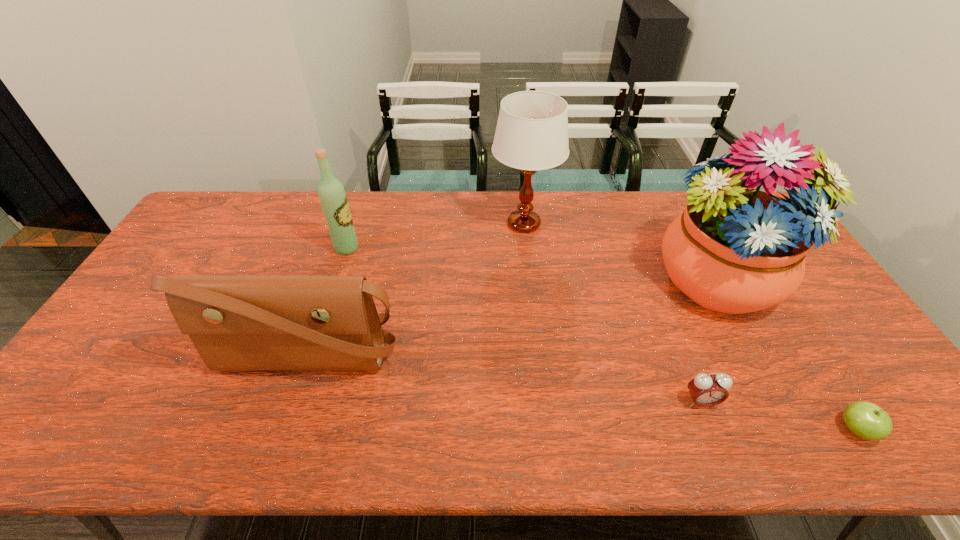
At what (x,y) coordinates should I click in order to perform the action: click on empty space that is in between the wine bottle and the shortest object. Please return your answer as a coordinate pair (x, y). Looking at the image, I should click on (601, 339).

Locate which object is the fourth closest to the satchel. Please provide its 2D coordinates. Your answer should be formatted as a tuple, i.e. [(x, y)], where the tuple contains the x and y coordinates of a point satisfying the conditions above.

[(734, 249)]

This screenshot has height=540, width=960. I want to click on object that is the fifth closest to the wine bottle, so click(866, 420).

Locate an element on the screen. The width and height of the screenshot is (960, 540). vacant space that satisfies the following two spatial constraints: 1. on the front-facing side of the wine bottle; 2. on the left side of the shortest object is located at coordinates (289, 430).

Locate an element on the screen. free region that satisfies the following two spatial constraints: 1. on the front flap of the satchel; 2. on the right side of the shortest object is located at coordinates (281, 430).

Where is `free space that satisfies the following two spatial constraints: 1. on the front-facing side of the flower arrangement; 2. on the left side of the wine bottle`? The height and width of the screenshot is (540, 960). free space that satisfies the following two spatial constraints: 1. on the front-facing side of the flower arrangement; 2. on the left side of the wine bottle is located at coordinates (336, 284).

Identify the location of free region that satisfies the following two spatial constraints: 1. on the front-facing side of the wine bottle; 2. on the front flap of the satchel. This screenshot has width=960, height=540. (313, 355).

Locate an element on the screen. The image size is (960, 540). free point that satisfies the following two spatial constraints: 1. on the front-facing side of the wine bottle; 2. on the front flap of the satchel is located at coordinates (313, 355).

Locate an element on the screen. Image resolution: width=960 pixels, height=540 pixels. free spot that satisfies the following two spatial constraints: 1. on the front-facing side of the wine bottle; 2. on the front flap of the satchel is located at coordinates 313,355.